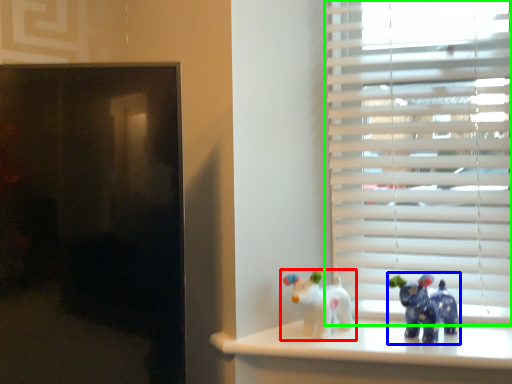
Question: Considering the real-world distances, which object is farthest from toy (highlighted by a red box)? toy (highlighted by a blue box) or window blind (highlighted by a green box)?

Choices:
 (A) toy
 (B) window blind

Answer: (B)